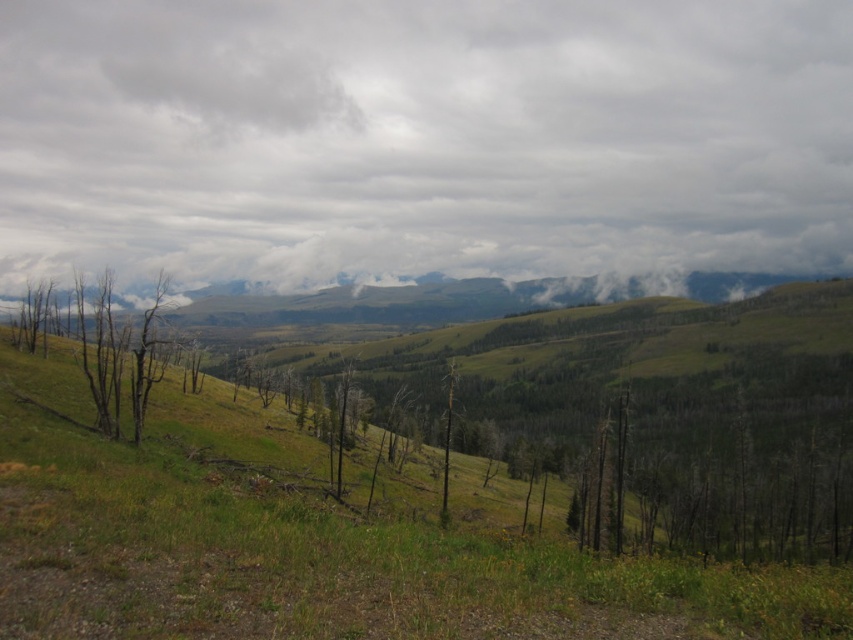
You are standing at the point marked by the coordinates point (321, 540) in the image. Based on the scene description, what type of terrain are you currently standing on?

The point (321, 540) is on green grassy at center, so you are standing on green grassy terrain.

You are standing on the green grassy at center looking up. Which direction should you look to see the cloudy sky at upper center?

You should look upward to see the cloudy sky at upper center, as it is positioned over the green grassy at center.